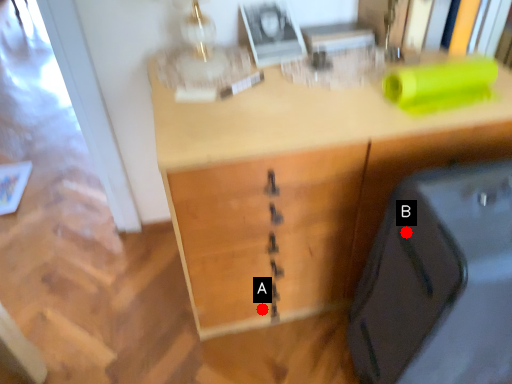
Question: Two points are circled on the image, labeled by A and B beside each circle. Which point is closer to the camera taking this photo?

Choices:
 (A) A is closer
 (B) B is closer

Answer: (B)